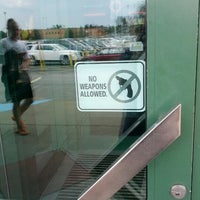
Find the location of a particular element. The width and height of the screenshot is (200, 200). mat on floor seen through glass in door is located at coordinates (64, 182), (74, 189), (91, 167), (104, 161), (86, 159).